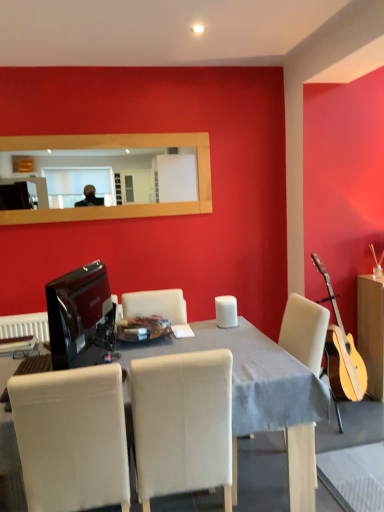
Question: From the image's perspective, does wooden frame mirror at upper center appear lower than clear glass plate at center?

Choices:
 (A) no
 (B) yes

Answer: (A)

Question: Does wooden frame mirror at upper center have a greater height compared to clear glass plate at center?

Choices:
 (A) no
 (B) yes

Answer: (B)

Question: Can you confirm if wooden frame mirror at upper center is shorter than clear glass plate at center?

Choices:
 (A) yes
 (B) no

Answer: (B)

Question: Does wooden frame mirror at upper center come in front of clear glass plate at center?

Choices:
 (A) no
 (B) yes

Answer: (A)

Question: From a real-world perspective, is wooden frame mirror at upper center on top of clear glass plate at center?

Choices:
 (A) yes
 (B) no

Answer: (A)

Question: Is wooden frame mirror at upper center not near clear glass plate at center?

Choices:
 (A) no
 (B) yes

Answer: (B)

Question: Is white fabric chair at lower left, which is the 1th chair in left-to-right order, at the back of wooden frame mirror at upper center?

Choices:
 (A) no
 (B) yes

Answer: (A)

Question: Does wooden frame mirror at upper center have a lesser width compared to white fabric chair at lower left, the second chair viewed from the right?

Choices:
 (A) yes
 (B) no

Answer: (A)

Question: Is wooden frame mirror at upper center positioned behind white fabric chair at lower left, which is the 1th chair in left-to-right order?

Choices:
 (A) yes
 (B) no

Answer: (A)

Question: Does wooden frame mirror at upper center come in front of white fabric chair at lower left, which is the 1th chair in left-to-right order?

Choices:
 (A) yes
 (B) no

Answer: (B)

Question: Can you confirm if wooden frame mirror at upper center is positioned to the right of white fabric chair at lower left, which is the 1th chair in left-to-right order?

Choices:
 (A) no
 (B) yes

Answer: (A)

Question: Does wooden frame mirror at upper center have a lesser height compared to white fabric chair at lower left, which is the 1th chair in left-to-right order?

Choices:
 (A) no
 (B) yes

Answer: (B)

Question: Can you confirm if white fabric chair at lower left, which is the 1th chair in left-to-right order, is positioned to the left of wooden cabinet at right?

Choices:
 (A) yes
 (B) no

Answer: (A)